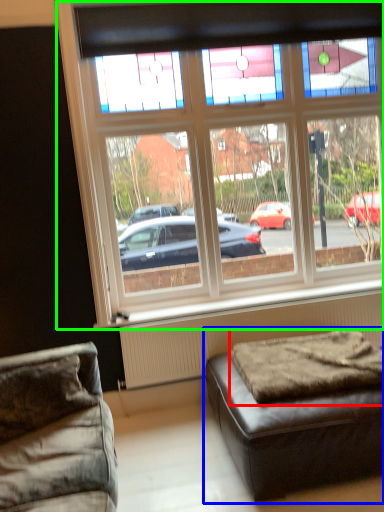
Question: Which is nearer to the mattress (highlighted by a red box)? studio couch (highlighted by a blue box) or window (highlighted by a green box).

Choices:
 (A) studio couch
 (B) window

Answer: (A)